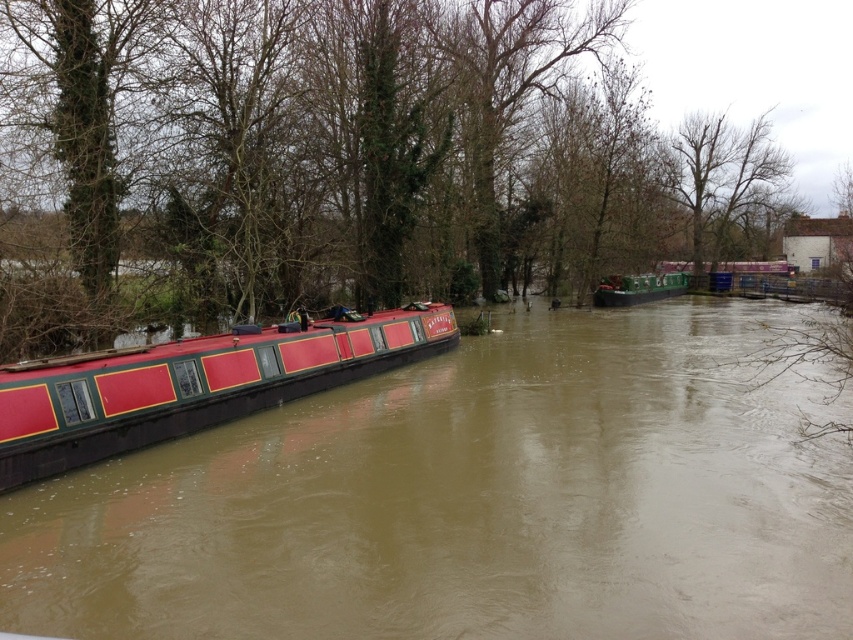
Question: Which point is closer to the camera?

Choices:
 (A) (228, 312)
 (B) (534, 360)
 (C) (634, 285)
 (D) (294, 342)

Answer: (D)

Question: Does green leafy tree at center have a greater width compared to bare branches at upper center?

Choices:
 (A) no
 (B) yes

Answer: (B)

Question: Estimate the real-world distances between objects in this image. Which object is farther from the bare branches at upper center?

Choices:
 (A) green matte barge at center
 (B) matte red boat at left
 (C) green leafy tree at center

Answer: (B)

Question: Which point is farther from the camera taking this photo?

Choices:
 (A) click(7, 480)
 (B) click(262, 588)
 (C) click(407, 28)
 (D) click(672, 292)

Answer: (D)

Question: Does green leafy tree at center lie in front of matte red barge at left?

Choices:
 (A) yes
 (B) no

Answer: (B)

Question: Is matte red barge at left smaller than bare branches at upper center?

Choices:
 (A) yes
 (B) no

Answer: (A)